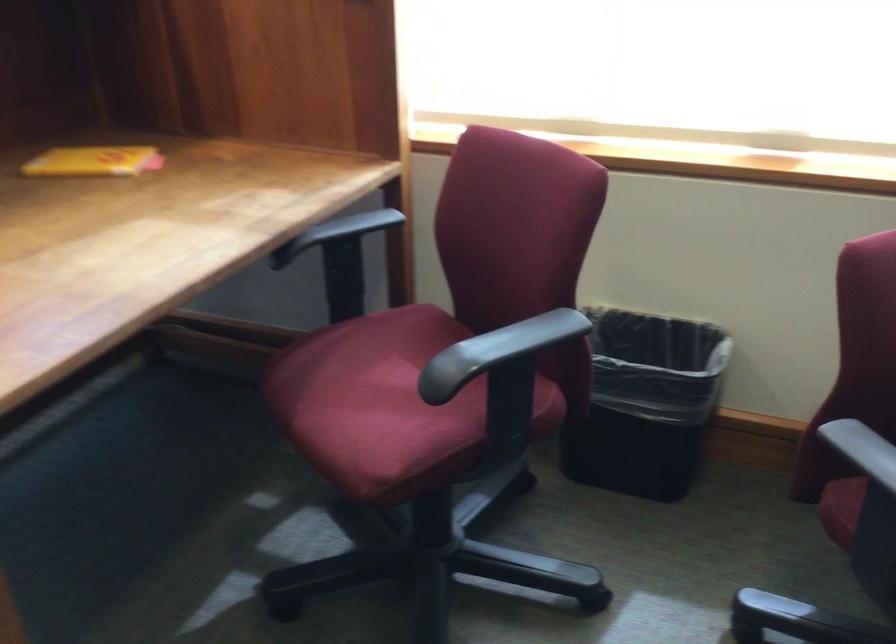
The first image is from the beginning of the video and the second image is from the end. How did the camera likely rotate when shooting the video?

The rotation direction of the camera is left-down.